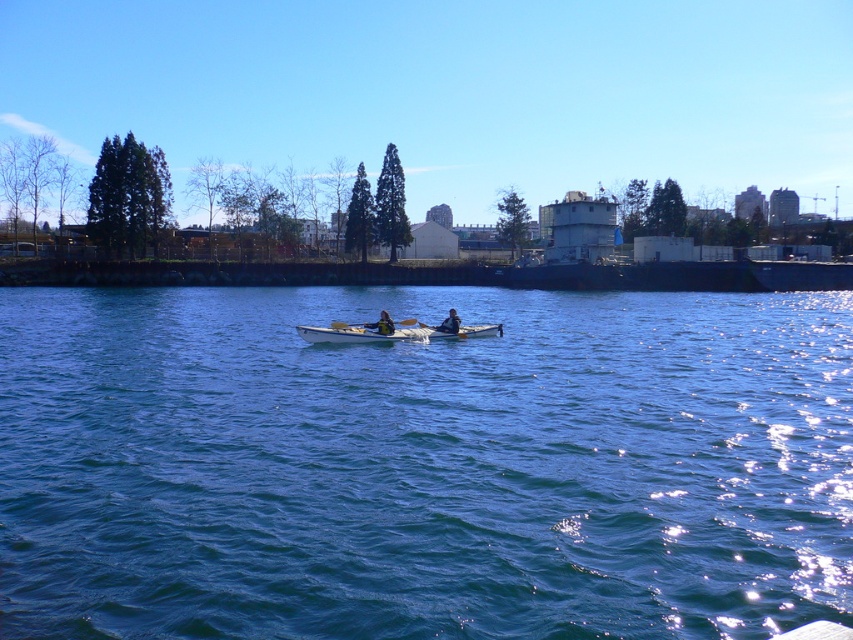
Question: Which object is positioned closest to the blue water at center?

Choices:
 (A) white plastic paddle at center
 (B) matte black kayak at center

Answer: (A)

Question: Is blue water at center bigger than matte black kayak at center?

Choices:
 (A) yes
 (B) no

Answer: (A)

Question: Where is blue water at center located in relation to white plastic paddle at center in the image?

Choices:
 (A) right
 (B) left

Answer: (A)

Question: Which of these objects is positioned closest to the matte black kayak at center?

Choices:
 (A) white plastic paddle at center
 (B) white plastic boat at center

Answer: (A)

Question: Based on their relative distances, which object is nearer to the blue water at center?

Choices:
 (A) white plastic paddle at center
 (B) dark blue fabric jacket at center
 (C) matte black kayak at center
 (D) white plastic boat at center

Answer: (B)

Question: Considering the relative positions of blue water at center and white plastic boat at center in the image provided, where is blue water at center located with respect to white plastic boat at center?

Choices:
 (A) left
 (B) right

Answer: (B)